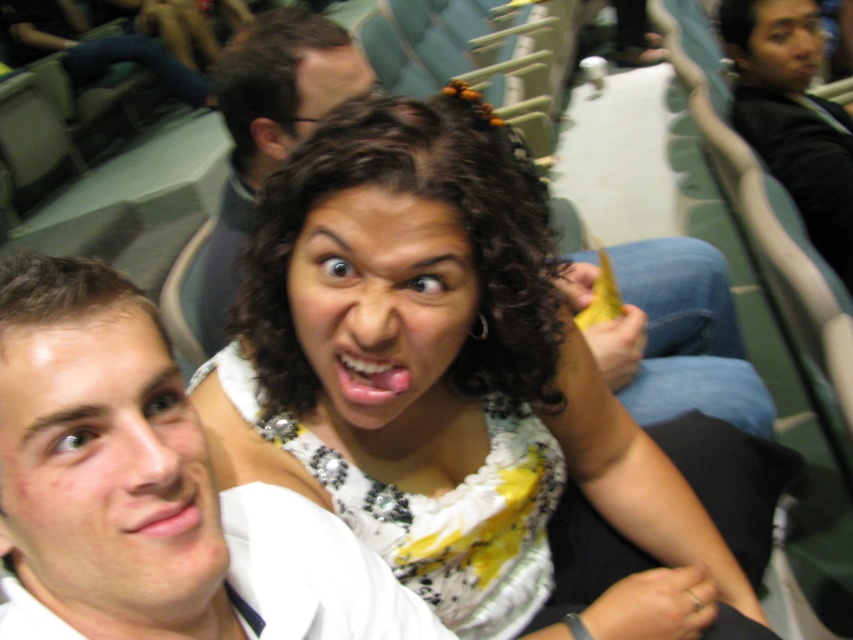
You are standing at the front row of the stadium, and you want to reach a point that is 18.20 inches away from you. Can you estimate if the point at coordinates point (19, 298) is the correct location to aim for?

The distance of point (19, 298) from viewer is 18.20 inches, so yes, the point at coordinates point (19, 298) is the correct location to aim for since it is exactly 18.20 inches away from you.

You are a photographer at the event and want to take a photo that includes both the white shirt at center and the matte white blouse at center. Which one should you adjust your camera focus to prioritize if you want the taller object to be in focus first?

The white shirt at center is taller than the matte white blouse at center, so you should prioritize focusing on the white shirt at center first.

You are a photographer standing in the front row of the stadium. You want to take a photo of the white shirt at center and the smooth skin face at left. Which object will appear larger in your photo?

The white shirt at center will appear larger in the photo because it is closer to the viewer than the smooth skin face at left.